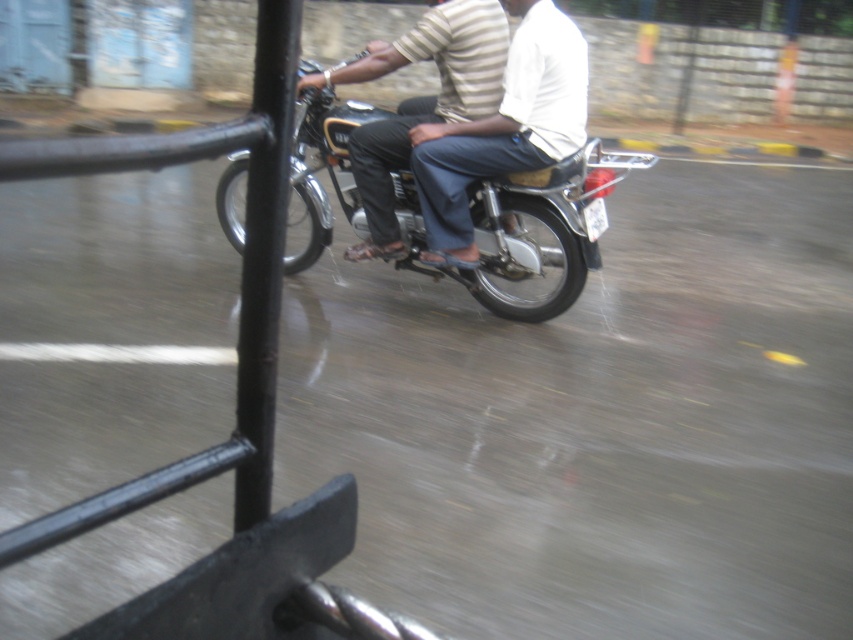
Who is shorter, shiny metallic motorcycle at center or light brown striped shirt at center?

Standing shorter between the two is light brown striped shirt at center.

Is point (296, 212) positioned in front of point (518, 64)?

No, it is behind (518, 64).

Locate an element on the screen. The width and height of the screenshot is (853, 640). shiny metallic motorcycle at center is located at coordinates (527, 228).

Is black metal pole at left behind striped cotton shirt at center?

No, black metal pole at left is in front of striped cotton shirt at center.

Is black metal pole at left below striped cotton shirt at center?

Correct, black metal pole at left is located below striped cotton shirt at center.

Who is more distant from viewer, (236,468) or (444,6)?

The point (444,6) is behind.

Find the location of a particular element. The height and width of the screenshot is (640, 853). black metal pole at left is located at coordinates (263, 253).

From the picture: Is light brown striped shirt at center below black metal pole at left?

Actually, light brown striped shirt at center is above black metal pole at left.

This screenshot has height=640, width=853. In order to click on light brown striped shirt at center in this screenshot , I will do `click(503, 129)`.